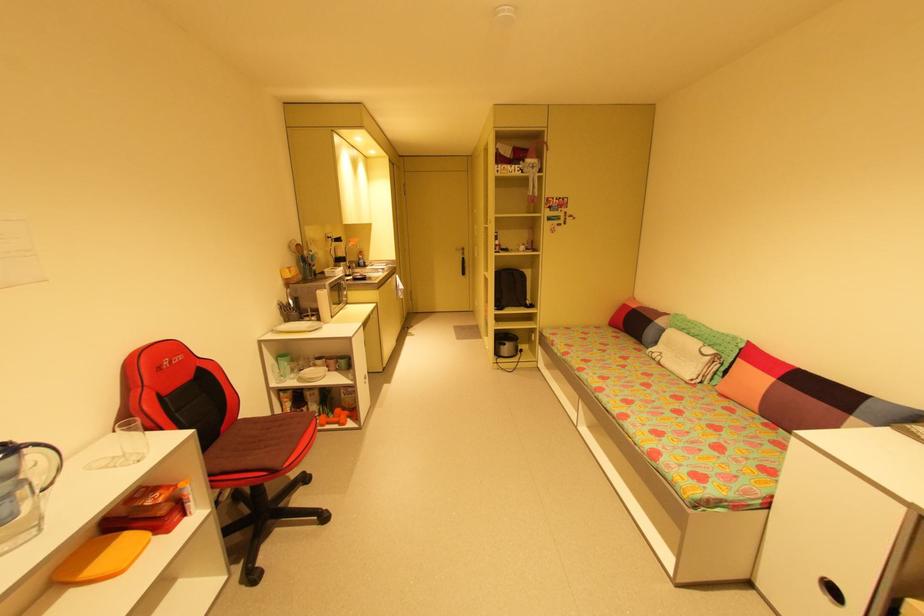
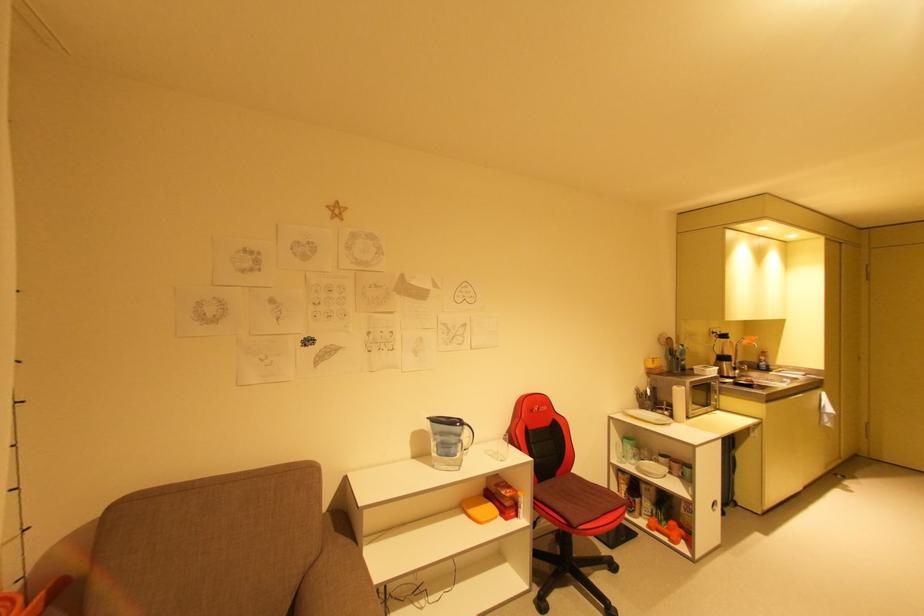
The point at (93, 572) is marked in the first image. Where is the corresponding point in the second image?

(477, 512)